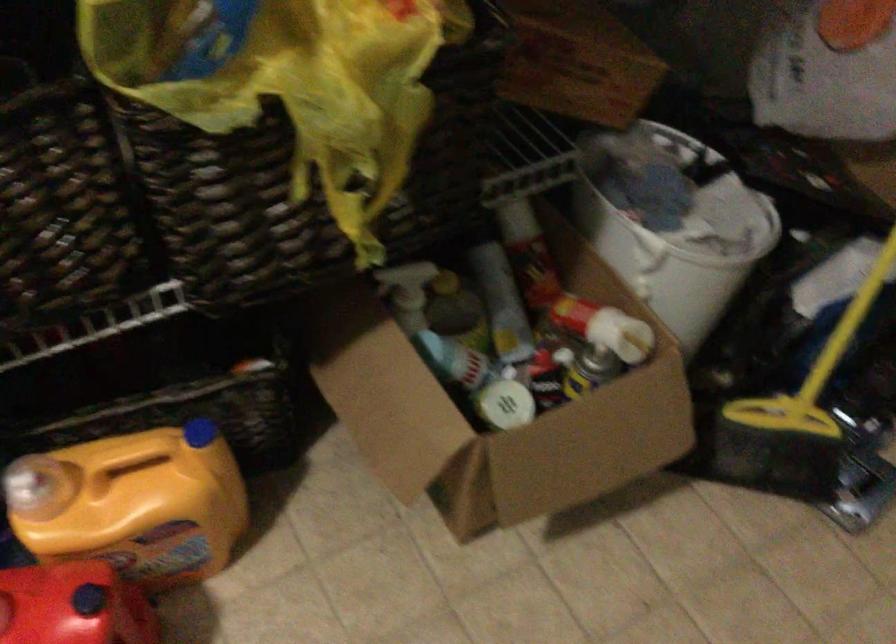
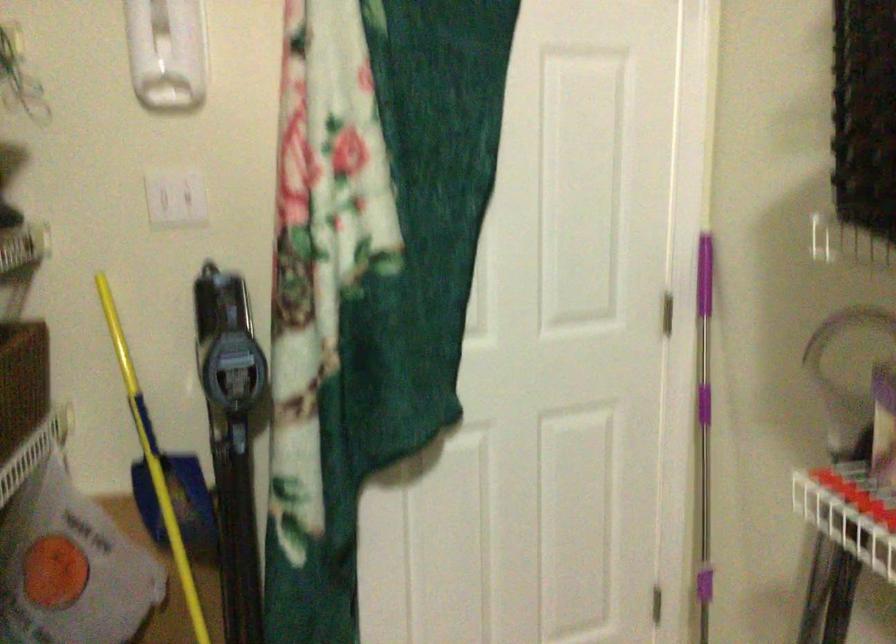
Question: Based on the continuous images, in which direction is the camera rotating? Reply with the corresponding letter.

Choices:
 (A) Left
 (B) Right
 (C) Up
 (D) Down

Answer: (B)